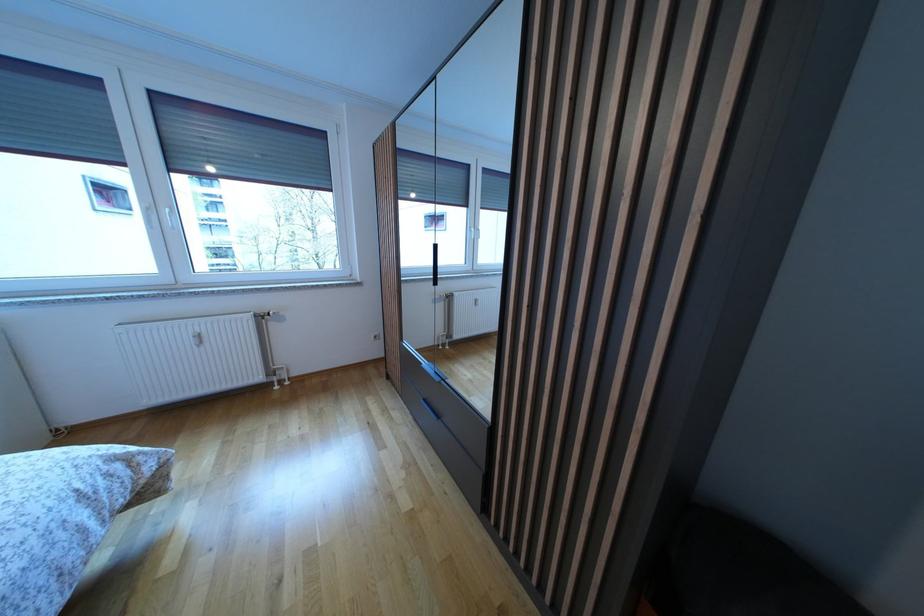
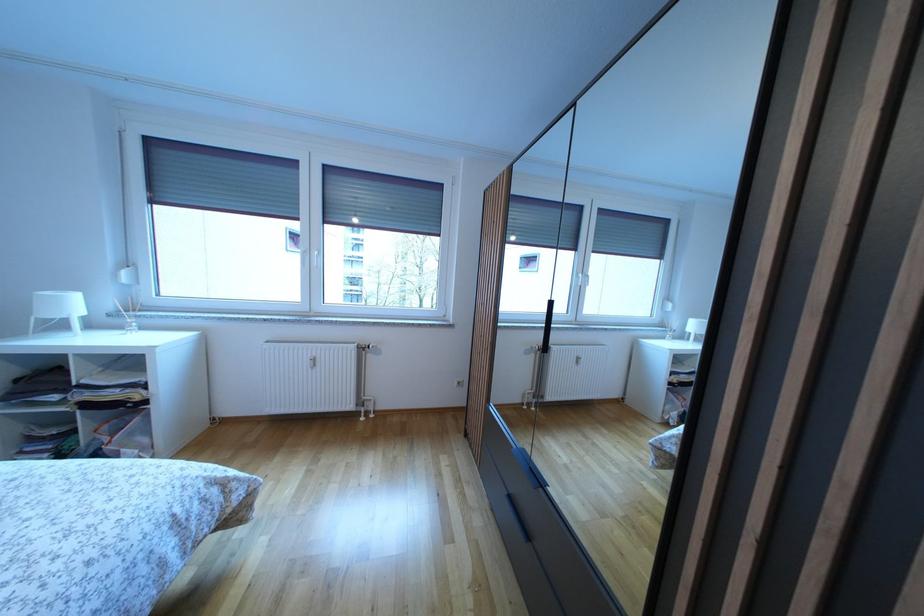
Question: The camera is either moving clockwise (left) or counter-clockwise (right) around the object. The first image is from the beginning of the video and the second image is from the end. Is the camera moving left or right when shooting the video?

Choices:
 (A) Left
 (B) Right

Answer: (B)